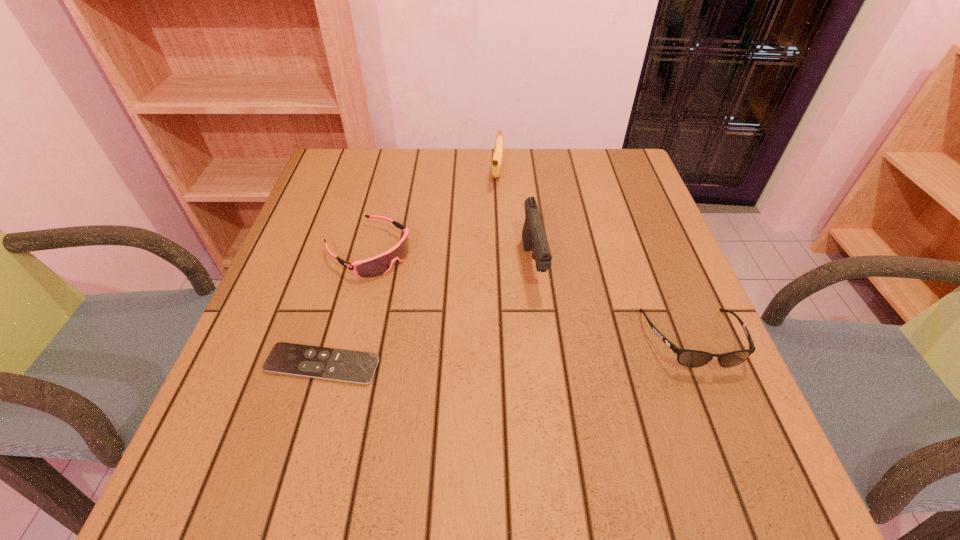
Where is `the shortest object`? Image resolution: width=960 pixels, height=540 pixels. the shortest object is located at coordinates (356, 367).

Locate an element on the screen. sunglasses is located at coordinates (688, 358).

In order to click on goggles in this screenshot , I will do `click(378, 265)`.

Locate an element on the screen. The image size is (960, 540). the fourth object from left to right is located at coordinates (534, 239).

The width and height of the screenshot is (960, 540). I want to click on the tallest object, so click(534, 239).

At what (x,y) coordinates should I click in order to perform the action: click on banana. Please return your answer as a coordinate pair (x, y). Looking at the image, I should click on (496, 166).

Where is `the third object from left to right`? The width and height of the screenshot is (960, 540). the third object from left to right is located at coordinates (496, 166).

The image size is (960, 540). I want to click on vacant space located on the right of the remote control, so click(x=406, y=364).

I want to click on free space located on the front-facing side of the goggles, so click(537, 365).

The height and width of the screenshot is (540, 960). Find the location of `vacant space located on the front-facing side of the goggles`. vacant space located on the front-facing side of the goggles is located at coordinates (439, 298).